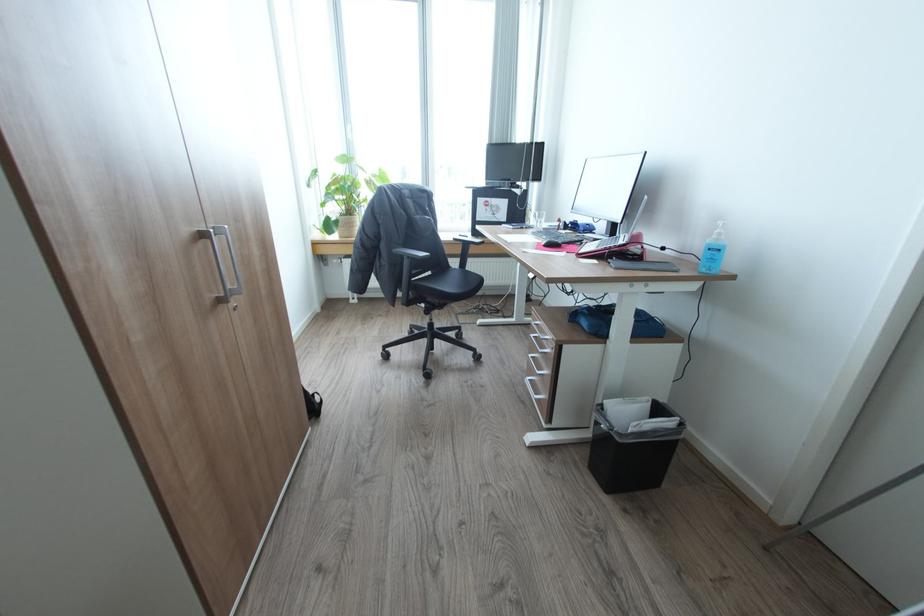
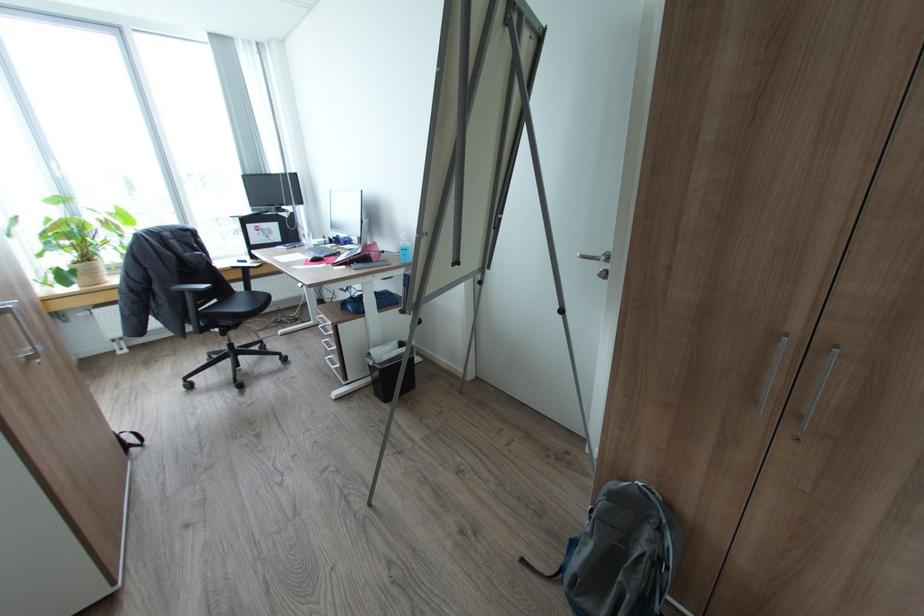
Where in the second image is the point corresponding to (383,174) from the first image?

(119, 211)